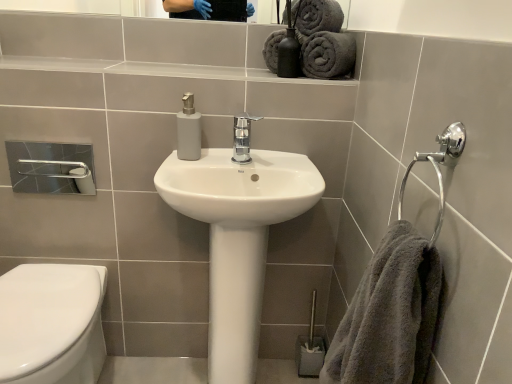
This screenshot has height=384, width=512. I want to click on vacant point above white glossy toilet at lower left (from a real-world perspective), so click(42, 302).